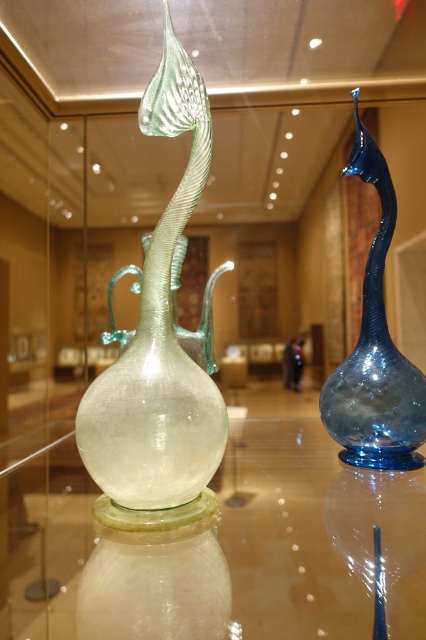
You are a museum curator arranging an exhibition. You need to place a new sculpture between the transparent glass vase at center and the blue glass vase at right. Where should you position the sculpture so it doesn

The transparent glass vase at center is in front of the blue glass vase at right. To place the sculpture between them, position it behind the transparent glass vase at center but in front of the blue glass vase at right so it sits between their depths.

You are a museum curator arranging an exhibit. You notice the transparent glass table at center and the blue glass vase at right. Which object is located below the other?

The transparent glass table at center is positioned under the blue glass vase at right, meaning the table is below the vase.

You are a museum curator arranging an exhibition. You need to place a label next to the taller vessel. Which vessel should you choose between the transparent glass vase at center and the blue glass vase at right?

The blue glass vase at right is taller than the transparent glass vase at center, so you should place the label next to the blue glass vase at right.